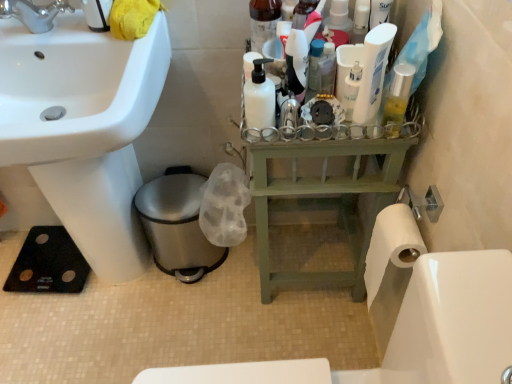
You are a GUI agent. You are given a task and a screenshot of the screen. Output one action in this format:
    pyautogui.click(x=<x>, y=<y>)
    Task: Click on the vacant space to the right of white matte bottle at center
    The width and height of the screenshot is (512, 384).
    Given the screenshot: What is the action you would take?
    point(314,124)